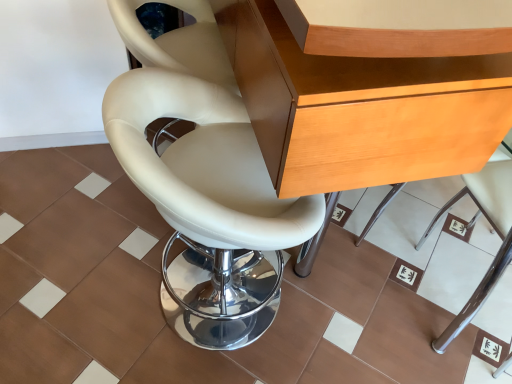
This screenshot has height=384, width=512. What are the coordinates of `wooden desk at center` in the screenshot? It's located at (359, 110).

What do you see at coordinates (493, 228) in the screenshot?
I see `white leather chair at lower right, the second chair viewed from the left` at bounding box center [493, 228].

Locate an element on the screen. This screenshot has width=512, height=384. white leather chair at center, positioned as the first chair in left-to-right order is located at coordinates (209, 204).

Is white leather chair at lower right, which is the first chair from right to left, not within white leather chair at center, which appears as the 2th chair when viewed from the right?

Yes, white leather chair at lower right, which is the first chair from right to left, is located beyond the bounds of white leather chair at center, which appears as the 2th chair when viewed from the right.

From the picture: From a real-world perspective, is white leather chair at lower right, the second chair viewed from the left, physically above white leather chair at center, which appears as the 2th chair when viewed from the right?

Incorrect, from a real-world perspective, white leather chair at lower right, the second chair viewed from the left, is lower than white leather chair at center, which appears as the 2th chair when viewed from the right.

Considering the relative sizes of white leather chair at lower right, which is the first chair from right to left, and white leather chair at center, positioned as the first chair in left-to-right order, in the image provided, is white leather chair at lower right, which is the first chair from right to left, smaller than white leather chair at center, positioned as the first chair in left-to-right order,?

Indeed, white leather chair at lower right, which is the first chair from right to left, has a smaller size compared to white leather chair at center, positioned as the first chair in left-to-right order.

From the image's perspective, is brown matte tile at center beneath wooden desk at center?

Yes, from the image's perspective, brown matte tile at center is below wooden desk at center.

Considering the sizes of objects brown matte tile at center and wooden desk at center in the image provided, who is smaller, brown matte tile at center or wooden desk at center?

With smaller size is brown matte tile at center.

Can you tell me how much brown matte tile at center and wooden desk at center differ in facing direction?

89.9 degrees.

At what (x,y) coordinates should I click in order to perform the action: click on ceramic tile located below the wooden desk at center (from the image's perspective). Please return your answer as a coordinate pair (x, y). The width and height of the screenshot is (512, 384). Looking at the image, I should click on (159, 280).

How different are the orientations of wooden desk at center and brown matte tile at center in degrees?

They differ by 89.9 degrees in their facing directions.

Is wooden desk at center to the left of brown matte tile at center from the viewer's perspective?

No.

From the image's perspective, is wooden desk at center beneath brown matte tile at center?

No, from the image's perspective, wooden desk at center is not beneath brown matte tile at center.

How different are the orientations of white leather chair at center, positioned as the first chair in left-to-right order, and white leather chair at lower right, the second chair viewed from the left, in degrees?

92.9 degrees.

Is point (190, 292) closer to camera compared to point (443, 207)?

Yes, it is in front of point (443, 207).

How much distance is there between white leather chair at center, positioned as the first chair in left-to-right order, and white leather chair at lower right, the second chair viewed from the left?

white leather chair at center, positioned as the first chair in left-to-right order, is 33.17 inches from white leather chair at lower right, the second chair viewed from the left.

Considering the sizes of objects white leather chair at center, positioned as the first chair in left-to-right order, and white leather chair at lower right, which is the first chair from right to left, in the image provided, who is bigger, white leather chair at center, positioned as the first chair in left-to-right order, or white leather chair at lower right, which is the first chair from right to left,?

white leather chair at center, positioned as the first chair in left-to-right order, is bigger.

Between white leather chair at lower right, the second chair viewed from the left, and wooden desk at center, which one has smaller width?

Thinner between the two is white leather chair at lower right, the second chair viewed from the left.

Is point (490, 272) behind point (256, 66)?

Yes.

Which is in front, white leather chair at lower right, which is the first chair from right to left, or wooden desk at center?

wooden desk at center is more forward.

Is white leather chair at lower right, the second chair viewed from the left, spatially inside wooden desk at center, or outside of it?

The correct answer is: outside.

Based on the photo, considering the sizes of white leather chair at center, which appears as the 2th chair when viewed from the right, and wooden desk at center in the image, is white leather chair at center, which appears as the 2th chair when viewed from the right, taller or shorter than wooden desk at center?

Considering their sizes, white leather chair at center, which appears as the 2th chair when viewed from the right, has less height than wooden desk at center.

Which is more to the right, white leather chair at center, which appears as the 2th chair when viewed from the right, or wooden desk at center?

wooden desk at center is more to the right.

Can you confirm if white leather chair at center, which appears as the 2th chair when viewed from the right, is smaller than wooden desk at center?

Correct, white leather chair at center, which appears as the 2th chair when viewed from the right, occupies less space than wooden desk at center.

Considering the sizes of objects white leather chair at center, which appears as the 2th chair when viewed from the right, and wooden desk at center in the image provided, who is wider, white leather chair at center, which appears as the 2th chair when viewed from the right, or wooden desk at center?

wooden desk at center is wider.

Could you measure the distance between white leather chair at lower right, the second chair viewed from the left, and brown matte tile at center?

A distance of 21.66 inches exists between white leather chair at lower right, the second chair viewed from the left, and brown matte tile at center.

From a real-world perspective, does white leather chair at lower right, the second chair viewed from the left, sit lower than brown matte tile at center?

Incorrect, from a real-world perspective, white leather chair at lower right, the second chair viewed from the left, is higher than brown matte tile at center.

Between point (502, 161) and point (424, 327), which one is positioned behind?

The point (502, 161) is more distant.

Can you confirm if white leather chair at lower right, the second chair viewed from the left, is positioned to the right of brown matte tile at center?

Yes, white leather chair at lower right, the second chair viewed from the left, is to the right of brown matte tile at center.

Identify the location of chair below the white leather chair at center, positioned as the first chair in left-to-right order (from a real-world perspective). (493, 228).

What are the coordinates of `desk above the brown matte tile at center (from a real-world perspective)` in the screenshot? It's located at (359, 110).

Looking at this image, looking at the image, which one is located closer to white leather chair at center, positioned as the first chair in left-to-right order, white leather chair at lower right, which is the first chair from right to left, or brown matte tile at center?

Based on the image, brown matte tile at center appears to be nearer to white leather chair at center, positioned as the first chair in left-to-right order.

Based on their spatial positions, is white leather chair at center, which appears as the 2th chair when viewed from the right, or white leather chair at lower right, the second chair viewed from the left, closer to brown matte tile at center?

The object closer to brown matte tile at center is white leather chair at lower right, the second chair viewed from the left.

When comparing their distances from wooden desk at center, does white leather chair at center, positioned as the first chair in left-to-right order, or brown matte tile at center seem further?

Based on the image, brown matte tile at center appears to be further to wooden desk at center.

Considering their positions, is wooden desk at center positioned closer to white leather chair at center, which appears as the 2th chair when viewed from the right, than brown matte tile at center?

wooden desk at center.

From the picture: Estimate the real-world distances between objects in this image. Which object is further from white leather chair at lower right, which is the first chair from right to left, brown matte tile at center or wooden desk at center?

wooden desk at center.

From the image, which object appears to be nearer to brown matte tile at center, white leather chair at lower right, the second chair viewed from the left, or white leather chair at center, positioned as the first chair in left-to-right order?

Based on the image, white leather chair at lower right, the second chair viewed from the left, appears to be nearer to brown matte tile at center.

Estimate the real-world distances between objects in this image. Which object is closer to wooden desk at center, brown matte tile at center or white leather chair at center, which appears as the 2th chair when viewed from the right?

white leather chair at center, which appears as the 2th chair when viewed from the right, lies closer to wooden desk at center than the other object.

Estimate the real-world distances between objects in this image. Which object is further from white leather chair at lower right, the second chair viewed from the left, wooden desk at center or brown matte tile at center?

Among the two, wooden desk at center is located further to white leather chair at lower right, the second chair viewed from the left.

Find the location of a particular element. Image resolution: width=512 pixels, height=384 pixels. ceramic tile between white leather chair at center, which appears as the 2th chair when viewed from the right, and white leather chair at lower right, the second chair viewed from the left, in the horizontal direction is located at coordinates (159, 280).

Where is `desk between white leather chair at center, which appears as the 2th chair when viewed from the right, and white leather chair at lower right, which is the first chair from right to left, from left to right`? This screenshot has height=384, width=512. desk between white leather chair at center, which appears as the 2th chair when viewed from the right, and white leather chair at lower right, which is the first chair from right to left, from left to right is located at coordinates (359, 110).

You are a GUI agent. You are given a task and a screenshot of the screen. Output one action in this format:
    pyautogui.click(x=<x>, y=<y>)
    Task: Click on the desk located between brown matte tile at center and white leather chair at lower right, the second chair viewed from the left, in the left-right direction
    The width and height of the screenshot is (512, 384).
    Given the screenshot: What is the action you would take?
    pyautogui.click(x=359, y=110)